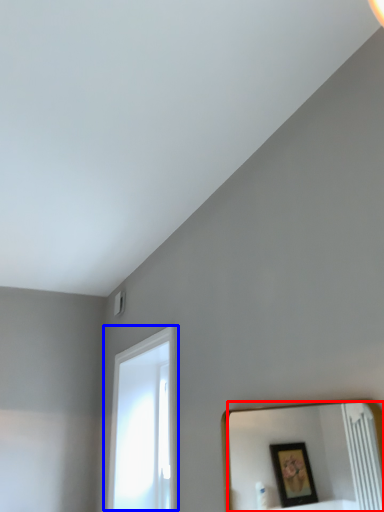
Question: Which point is further to the camera, mirror (highlighted by a red box) or window (highlighted by a blue box)?

Choices:
 (A) mirror
 (B) window

Answer: (B)